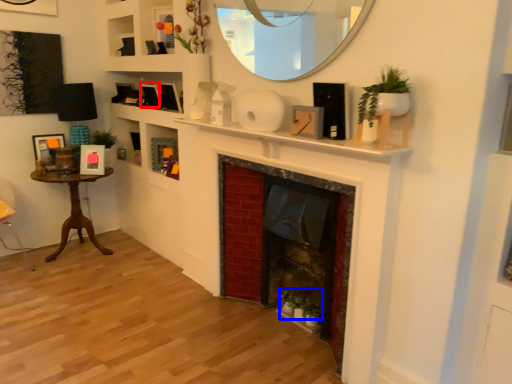
Question: Which of the following is the closest to the observer, picture frame (highlighted by a red box) or plant (highlighted by a blue box)?

Choices:
 (A) picture frame
 (B) plant

Answer: (B)